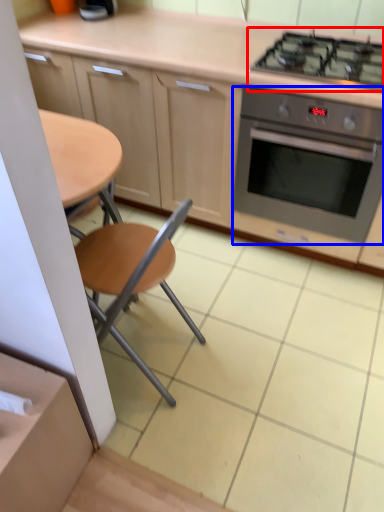
Question: Which of the following is the farthest to the observer, gas stove (highlighted by a red box) or kitchen appliance (highlighted by a blue box)?

Choices:
 (A) gas stove
 (B) kitchen appliance

Answer: (B)